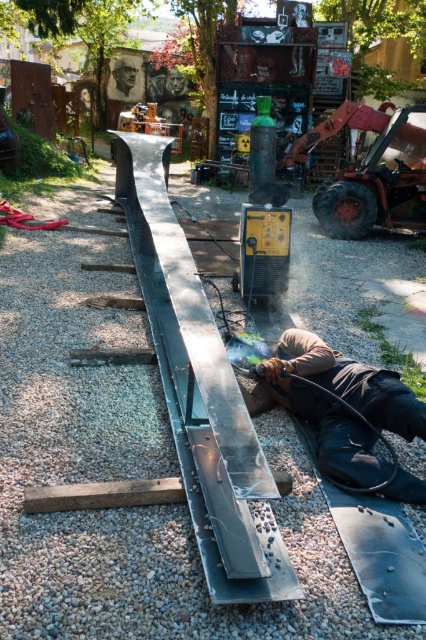
You are planning to place a 1.2 meter wide wooden board in the center of the outdoor workshop. Given the gray gravel at center and the polished steel rail at center, which object will the board overlap with first?

The gray gravel at center has a lesser width compared to polished steel rail at center, so the 1.2 meter wide wooden board will overlap with the gray gravel at center first.

You are a safety inspector checking the workshop. You notice the polished steel rail at center and the metallic orange forklift at right. Which object is shorter in height?

The polished steel rail at center is not as tall as the metallic orange forklift at right, so the polished steel rail at center is shorter in height.